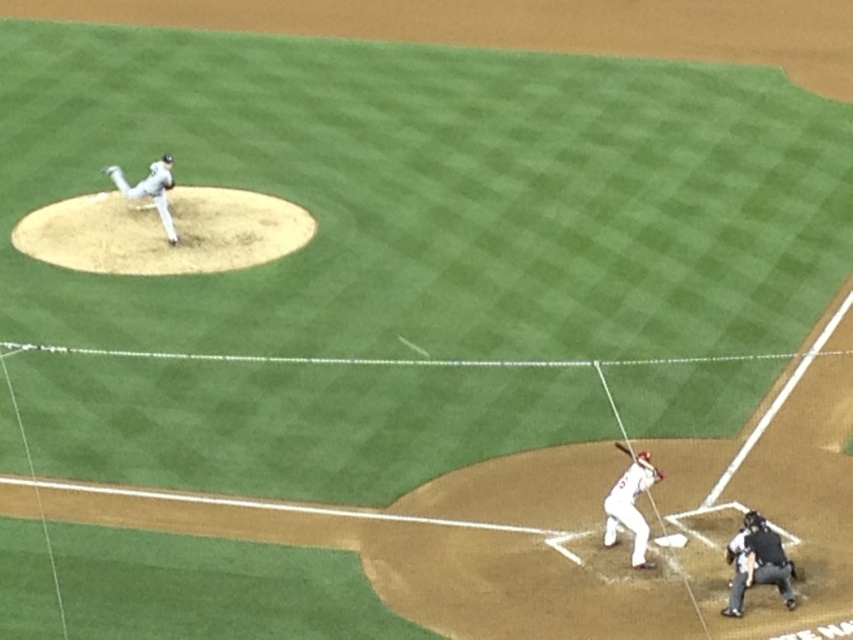
You are a baseball player standing at home plate and want to throw a ball to the pitcher. Which direction should you aim to reach the white matte baseball pitcher at upper left first, considering the brown dirt mound at upper left is in the way?

The brown dirt mound at upper left is located below the white matte baseball pitcher at upper left, so you should aim above the brown dirt mound at upper left to reach the white matte baseball pitcher at upper left first.

You are a drone operator trying to capture a closeup of the black leather umpire at lower right. The drone has a camera with a 100mm lens that can focus on objects within a 5cm radius. The drone is currently hovering at point 0.880, 0.889. Can you confirm if the drone is positioned correctly to capture the umpire?

The black leather umpire at lower right is located at point (757, 563), so yes, the drone is hovering exactly at the umpire location and can capture the umpire with the 100mm lens.

You are a player standing at the pitcher mound and you see the wooden bat at lower center. Where is the wooden bat located relative to your position?

The wooden bat at lower center is located at point coordinates of 0.727 on the x axis and 0.761 on the y axis.